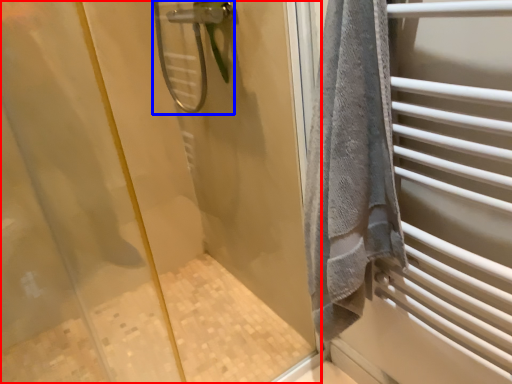
Question: Which of the following is the farthest to the observer, screen door (highlighted by a red box) or shower (highlighted by a blue box)?

Choices:
 (A) screen door
 (B) shower

Answer: (B)